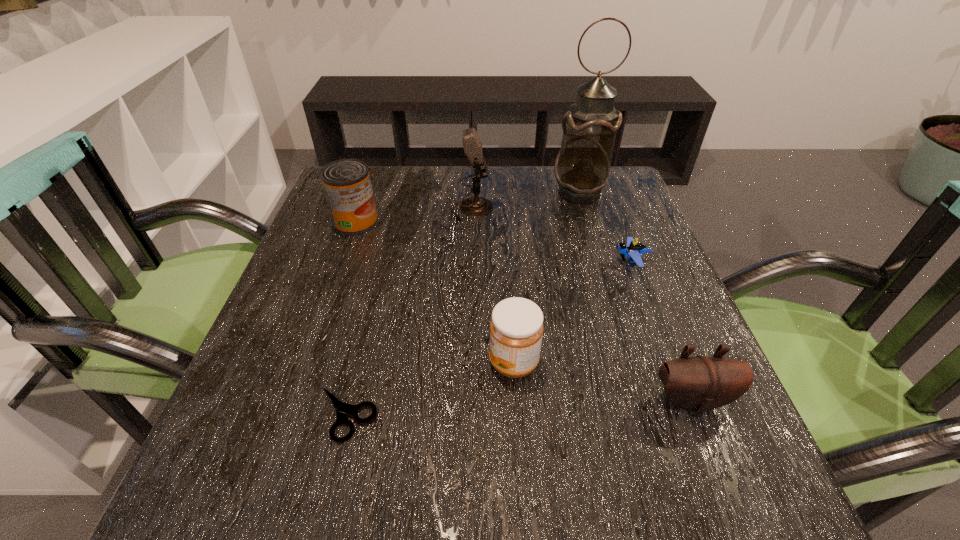
Where is `microphone that is at the far edge`? This screenshot has width=960, height=540. microphone that is at the far edge is located at coordinates (474, 206).

Image resolution: width=960 pixels, height=540 pixels. In order to click on can positioned at the far edge in this screenshot , I will do `click(346, 183)`.

At what (x,y) coordinates should I click in order to perform the action: click on can located at the left edge. Please return your answer as a coordinate pair (x, y). This screenshot has height=540, width=960. Looking at the image, I should click on (346, 183).

This screenshot has width=960, height=540. I want to click on shears positioned at the left edge, so click(x=342, y=409).

In order to click on oil lamp present at the right edge in this screenshot , I will do `click(582, 168)`.

Image resolution: width=960 pixels, height=540 pixels. I want to click on pouch that is at the right edge, so click(x=697, y=384).

The width and height of the screenshot is (960, 540). What are the coordinates of `Lego present at the right edge` in the screenshot? It's located at (634, 250).

This screenshot has height=540, width=960. In order to click on object that is at the far left corner in this screenshot , I will do `click(346, 183)`.

This screenshot has width=960, height=540. I want to click on object situated at the far right corner, so click(582, 168).

The width and height of the screenshot is (960, 540). What are the coordinates of `vacant space at the far edge of the desktop` in the screenshot? It's located at coord(549,174).